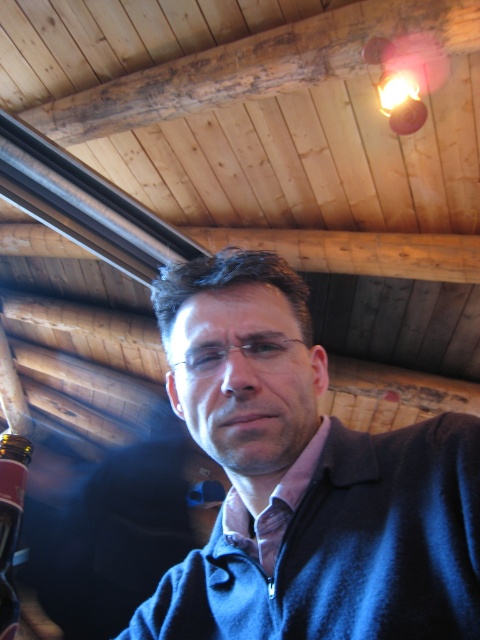
Question: Can you confirm if blue fleece jacket at center is positioned to the right of translucent glass bottle at lower left?

Choices:
 (A) yes
 (B) no

Answer: (A)

Question: Is blue fleece jacket at center bigger than translucent glass bottle at lower left?

Choices:
 (A) yes
 (B) no

Answer: (A)

Question: Which point is closer to the camera?

Choices:
 (A) (8, 499)
 (B) (398, 493)

Answer: (B)

Question: Which of the following is the farthest from the observer?

Choices:
 (A) blue fleece jacket at center
 (B) translucent glass bottle at lower left

Answer: (B)

Question: Does blue fleece jacket at center lie in front of translucent glass bottle at lower left?

Choices:
 (A) no
 (B) yes

Answer: (B)